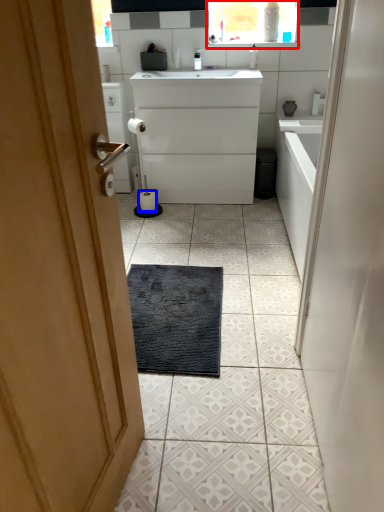
Question: Which point is further to the camera, medicine cabinet (highlighted by a red box) or toilet paper (highlighted by a blue box)?

Choices:
 (A) medicine cabinet
 (B) toilet paper

Answer: (B)